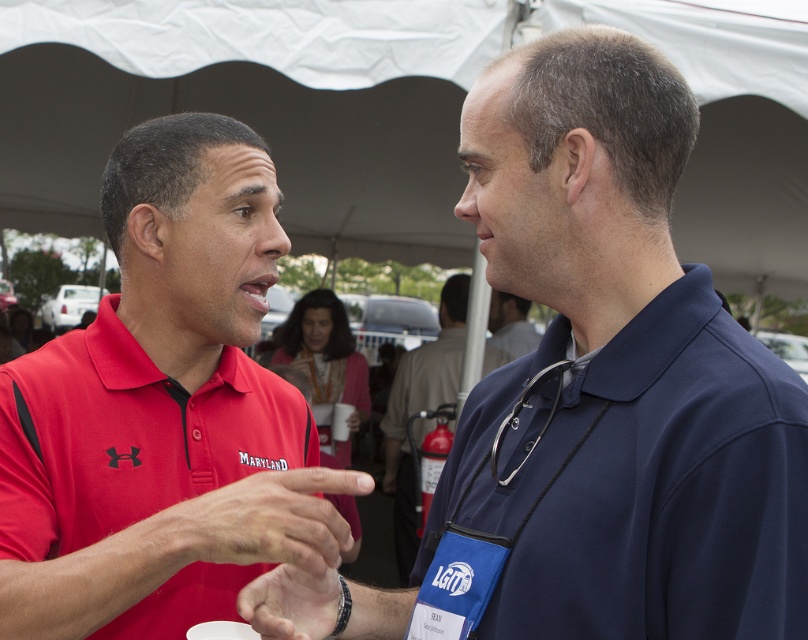
Is point (173, 497) positioned in front of point (646, 465)?

No, it is behind (646, 465).

Does red matte polo shirt at center appear on the right side of navy blue polo shirt at upper right?

In fact, red matte polo shirt at center is to the left of navy blue polo shirt at upper right.

Is point (186, 396) closer to viewer compared to point (729, 604)?

No, it is not.

In order to click on red matte polo shirt at center in this screenshot , I will do `click(162, 410)`.

Is red matte polo shirt at center smaller than blue fabric shirt at center?

No.

The height and width of the screenshot is (640, 808). I want to click on red matte polo shirt at center, so click(x=162, y=410).

What are the coordinates of `red matte polo shirt at center` in the screenshot? It's located at (162, 410).

In the scene shown: Is navy blue polo shirt at upper right positioned in front of blue fabric shirt at center?

Yes.

Find the location of `navy blue polo shirt at upper right`. navy blue polo shirt at upper right is located at coordinates (646, 483).